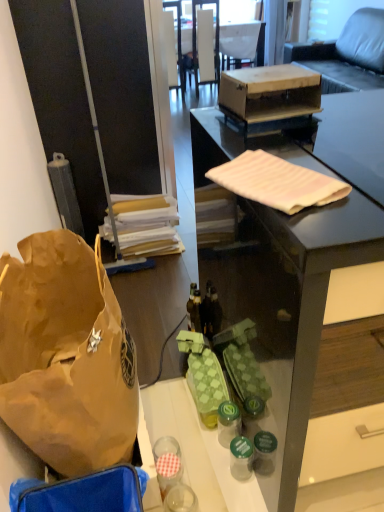
Question: Is matte black desk at center not inside wooden box at center?

Choices:
 (A) yes
 (B) no

Answer: (A)

Question: Is wooden box at center located within matte black desk at center?

Choices:
 (A) yes
 (B) no

Answer: (B)

Question: Is matte black desk at center oriented away from wooden box at center?

Choices:
 (A) yes
 (B) no

Answer: (B)

Question: Can you confirm if matte black desk at center is smaller than wooden box at center?

Choices:
 (A) yes
 (B) no

Answer: (B)

Question: Considering the relative sizes of matte black desk at center and wooden box at center in the image provided, is matte black desk at center taller than wooden box at center?

Choices:
 (A) no
 (B) yes

Answer: (B)

Question: Is matte black desk at center closer to the viewer compared to wooden box at center?

Choices:
 (A) no
 (B) yes

Answer: (B)

Question: From a real-world perspective, is green plastic bottle at center, the second bottle when ordered from front to back, located beneath translucent plastic bottle at center, the 3th bottle from the bottom?

Choices:
 (A) yes
 (B) no

Answer: (A)

Question: Can you confirm if green plastic bottle at center, the 2th bottle from the back, is smaller than translucent plastic bottle at center, the 3th bottle from the bottom?

Choices:
 (A) yes
 (B) no

Answer: (B)

Question: Does green plastic bottle at center, the second bottle when ordered from front to back, have a greater height compared to translucent plastic bottle at center, the first bottle positioned from the top?

Choices:
 (A) no
 (B) yes

Answer: (A)

Question: Considering the relative sizes of green plastic bottle at center, the second bottle when ordered from front to back, and translucent plastic bottle at center, which ranks as the 3th bottle in front-to-back order, in the image provided, is green plastic bottle at center, the second bottle when ordered from front to back, shorter than translucent plastic bottle at center, which ranks as the 3th bottle in front-to-back order,?

Choices:
 (A) no
 (B) yes

Answer: (B)

Question: From a real-world perspective, is green plastic bottle at center, the second bottle when ordered from front to back, located higher than translucent plastic bottle at center, which ranks as the 3th bottle in front-to-back order?

Choices:
 (A) no
 (B) yes

Answer: (A)

Question: From the image's perspective, is green plastic bottle at center, the second bottle when ordered from front to back, on top of translucent plastic bottle at center, which ranks as the 3th bottle in front-to-back order?

Choices:
 (A) yes
 (B) no

Answer: (B)

Question: Is brown paper bag at left located within leather couch at upper right?

Choices:
 (A) no
 (B) yes

Answer: (A)